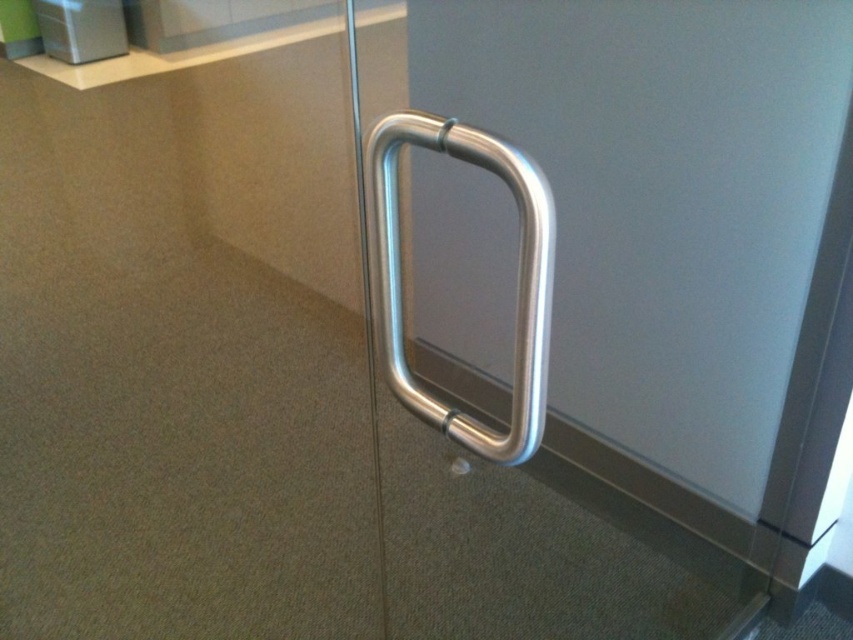
You are a delivery person trying to open the door. You see the silver metallic handle at center and the polished metal door handle at right. Which handle should you pull to open the door?

The silver metallic handle at center is the correct one to pull since it is the primary handle for opening the door, while the polished metal door handle at right might be a secondary handle for locking or additional grip.

You are standing in front of the glass door with the metallic handle. There are two points marked on the door. The first point is at coordinates point (564, 388) and the second point is at point (535, 388). If you move your hand forward towards the door, which point will your hand reach first?

Point (535, 388) will be reached first because it is closer to you than point (564, 388), which is further away from the camera.

You are trying to open the door but can only reach the area around the point marked at coordinates [624,316]. Is the silver metallic handle at center within your reach?

The point at coordinates [624,316] indicates the silver metallic handle at center, so yes, the handle is within your reach.